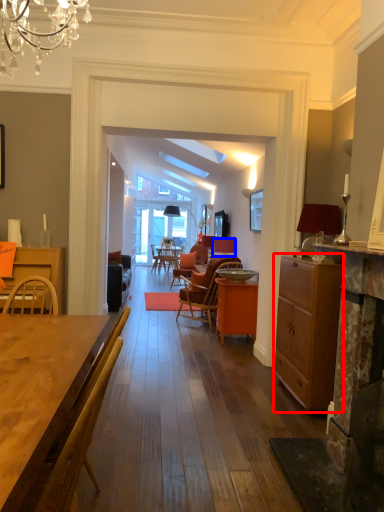
Question: Which object appears farthest to the camera in this image, cabinetry (highlighted by a red box) or loudspeaker (highlighted by a blue box)?

Choices:
 (A) cabinetry
 (B) loudspeaker

Answer: (B)